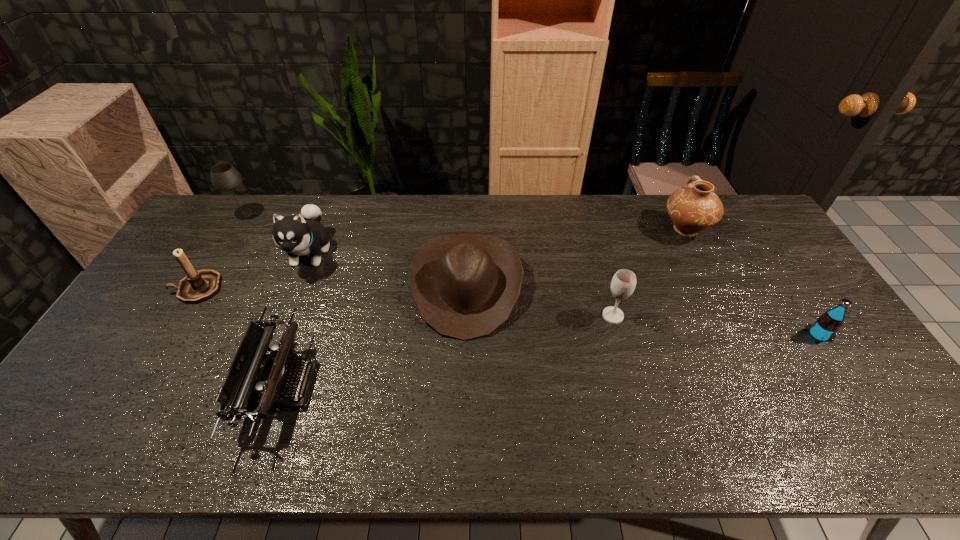
Image resolution: width=960 pixels, height=540 pixels. What are the coordinates of `puppy` in the screenshot? It's located at [x=303, y=234].

Locate an element on the screen. The width and height of the screenshot is (960, 540). the farther wineglass is located at coordinates (224, 177).

Identify the location of the second object from right to left. The image size is (960, 540). (694, 208).

Where is `the third object from right to left`? the third object from right to left is located at coordinates (623, 283).

Locate an element on the screen. the nearer wineglass is located at coordinates point(623,283).

Where is `candle holder`? The width and height of the screenshot is (960, 540). candle holder is located at coordinates (197, 286).

At what (x,y) coordinates should I click in order to perform the action: click on cowboy hat. Please return your answer as a coordinate pair (x, y). This screenshot has width=960, height=540. Looking at the image, I should click on (465, 286).

Find the location of a particular element. This screenshot has width=960, height=540. soda is located at coordinates (824, 329).

Where is `typewriter`? This screenshot has height=540, width=960. typewriter is located at coordinates (252, 370).

The image size is (960, 540). What are the coordinates of `vacant area situated 0.380m at the face of the puppy` in the screenshot? It's located at (256, 390).